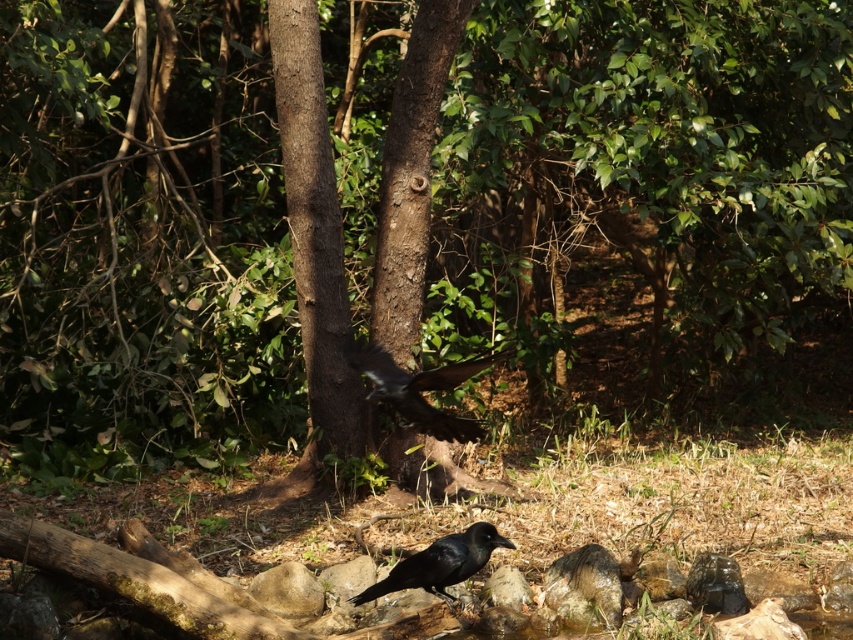
You are a birdwatcher trying to observe both shiny black raven at center and shiny black raven at lower center. Which raven do you need to look at first to see the one that is closer to you?

The shiny black raven at center is closer to the viewer than the shiny black raven at lower center, so you should look at the shiny black raven at center first.

You are a birdwatcher trying to locate the shiny black raven at center in the forest. Based on its 2D coordinates, which part of the image should you focus on to find it?

The shiny black raven at center is located at the 2D coordinates point (419, 388), so you should focus on the central area of the image to find it.

Based on the photo, you are a hiker who wants to take a photo of the shiny black raven at center and the shiny black raven at lower center. Since you have a camera with a zoom lens, you can focus on one bird at a time. Which raven should you focus on first if you want to capture the one that is higher up in the image?

The shiny black raven at center is located above the shiny black raven at lower center, so you should focus on the shiny black raven at center first to capture the one higher up.